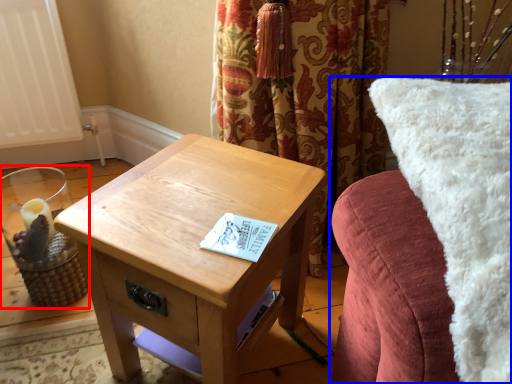
Question: Which object is further to the camera taking this photo, candle holder (highlighted by a red box) or furniture (highlighted by a blue box)?

Choices:
 (A) candle holder
 (B) furniture

Answer: (A)